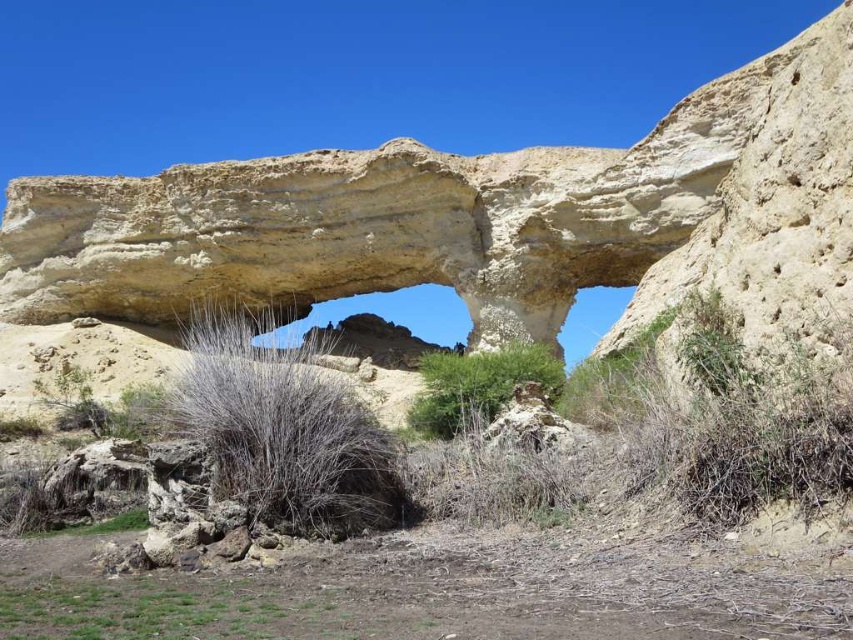
Question: Which object is positioned farthest from the dry grass at center?

Choices:
 (A) green leafy bush at center
 (B) matte sandstone rock arch at center

Answer: (B)

Question: Is dry grass at center bigger than green leafy bush at center?

Choices:
 (A) no
 (B) yes

Answer: (B)

Question: Which object appears farthest from the camera in this image?

Choices:
 (A) matte sandstone rock arch at center
 (B) green leafy bush at center

Answer: (B)

Question: Is matte sandstone rock arch at center positioned behind dry grass at center?

Choices:
 (A) no
 (B) yes

Answer: (A)

Question: Among these objects, which one is nearest to the camera?

Choices:
 (A) green leafy bush at center
 (B) dry grass at center
 (C) matte sandstone rock arch at center

Answer: (C)

Question: Does matte sandstone rock arch at center appear under dry grass at center?

Choices:
 (A) yes
 (B) no

Answer: (B)